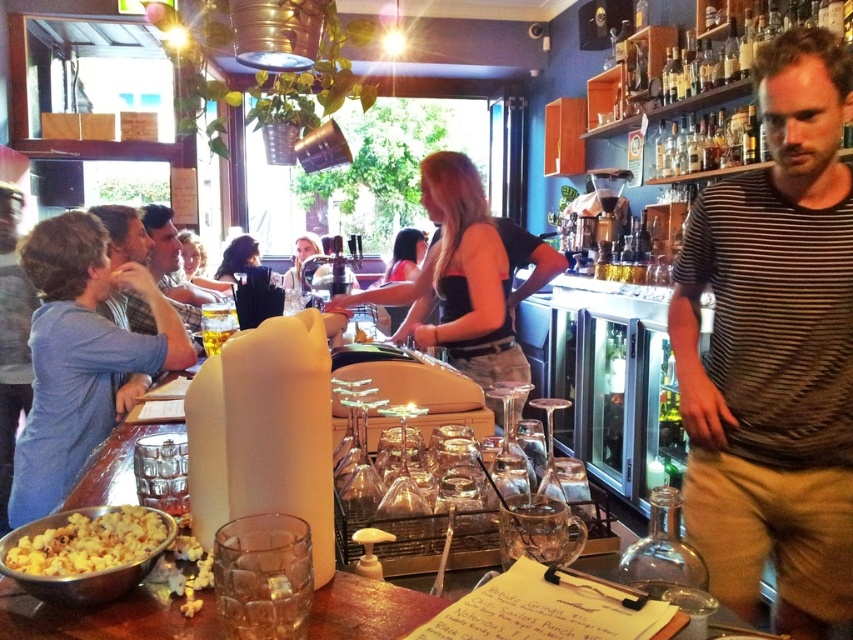
Question: Is brown striped shirt at center behind golden popcorn at lower left?

Choices:
 (A) no
 (B) yes

Answer: (B)

Question: Can you confirm if golden popcorn at lower left is smaller than plaid shirt at left?

Choices:
 (A) yes
 (B) no

Answer: (A)

Question: Which point appears farthest from the camera in this image?

Choices:
 (A) (88, 572)
 (B) (424, 304)
 (C) (173, 564)
 (D) (791, 189)

Answer: (B)

Question: Among these points, which one is nearest to the camera?

Choices:
 (A) (483, 282)
 (B) (178, 301)

Answer: (A)

Question: Is golden popcorn at lower left to the left of plaid shirt at left from the viewer's perspective?

Choices:
 (A) no
 (B) yes

Answer: (A)

Question: Estimate the real-world distances between objects in this image. Which object is farther from the plaid shirt at left?

Choices:
 (A) black matte tank top at center
 (B) gray cotton shirt at left
 (C) golden popcorn at lower left
 (D) brown striped shirt at center

Answer: (C)